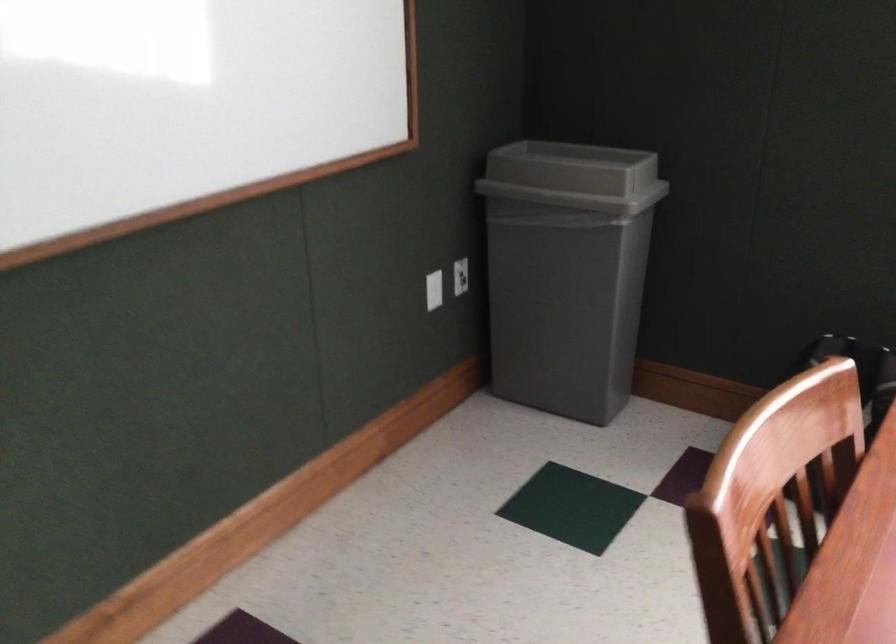
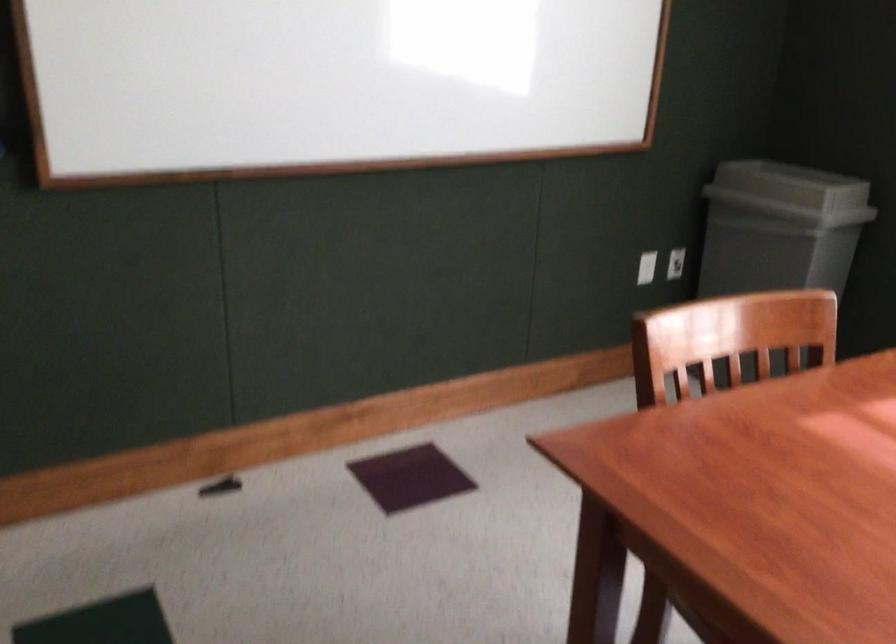
What movement of the cameraman would produce the second image?

The movement direction of the cameraman is right, backward.